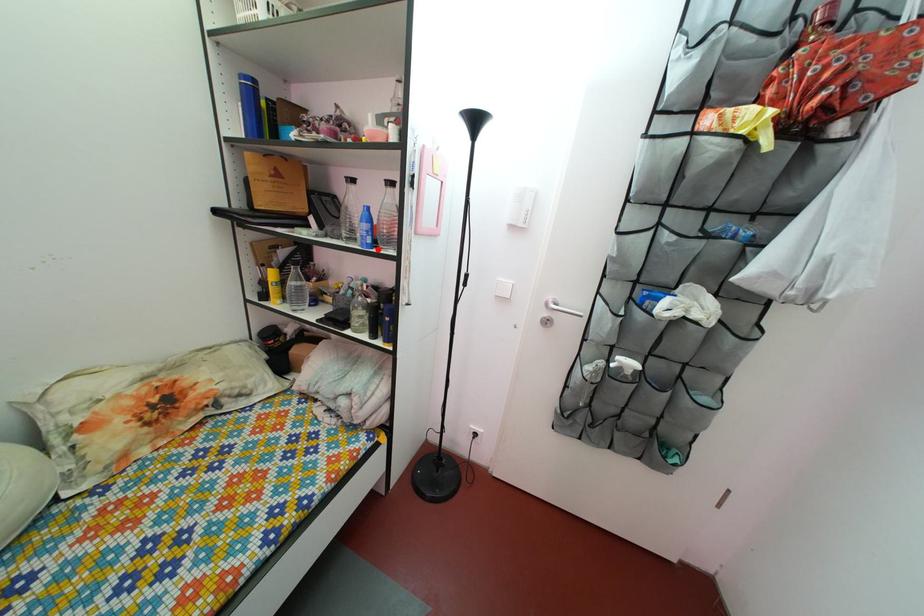
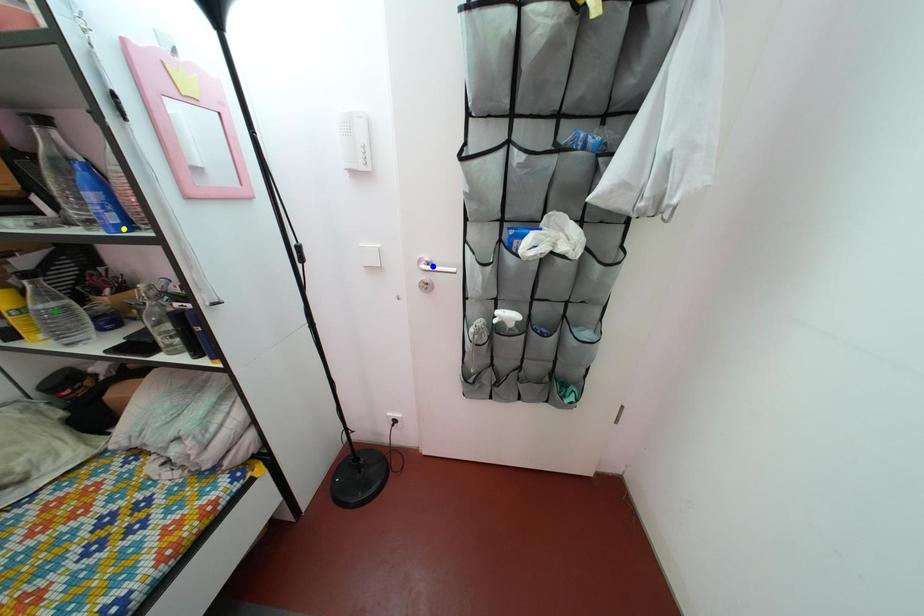
Question: I am providing you with two images of the same scene from different viewpoints. A red point is marked on the first image. You are given multiple points on the second image. Which mark in image 2 goes with the point in image 1?

Choices:
 (A) yellow point
 (B) green point
 (C) blue point

Answer: (A)